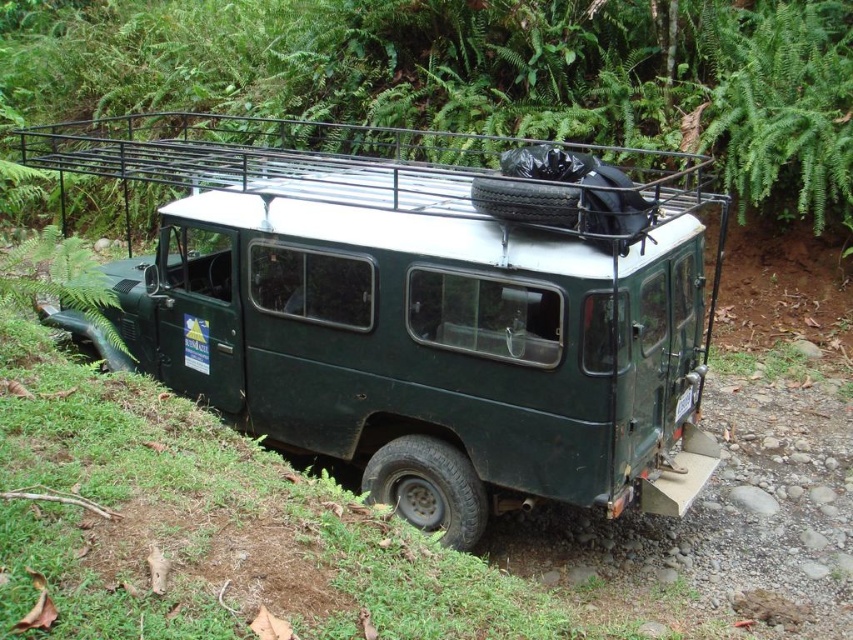
You are standing at the point marked by the coordinates (421, 312) in the image. What object are you currently at?

The point marked by the coordinates (421, 312) corresponds to the green matte jeep at center.

You are a hiker trying to navigate through the forest. You see the green matte jeep at center and the green leafy vegetation at upper center. Which object is positioned more to the right side of the image?

The green matte jeep at center is positioned more to the right side of the image compared to the green leafy vegetation at upper center.

You are a photographer planning to capture the green matte jeep at center and the green leafy vegetation at upper center in a single frame. Given that your camera can only focus on objects wider than a certain threshold, which object should you prioritize to ensure it is in focus?

The green leafy vegetation at upper center should be prioritized because it is wider than the green matte jeep at center, making it more likely to meet the camera focus requirement.